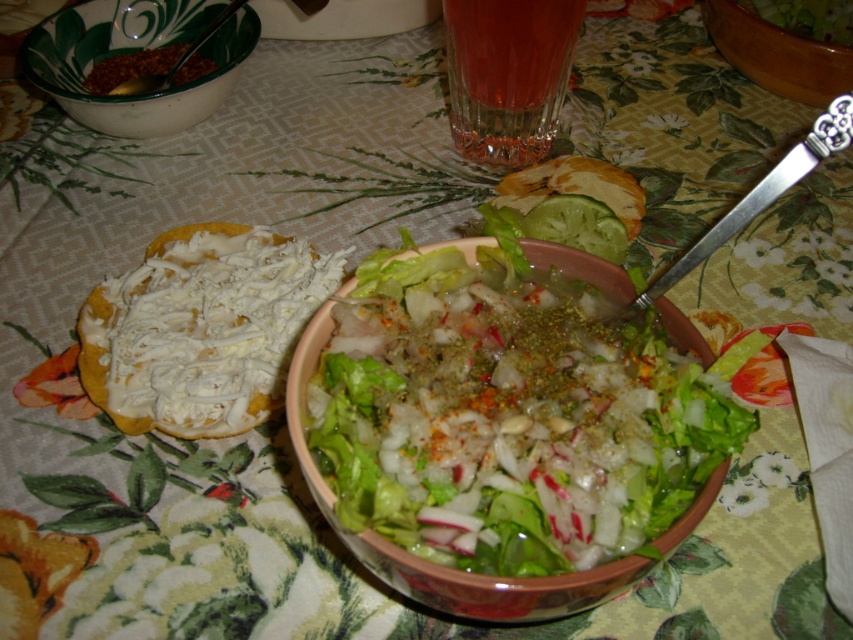
Question: Is fresh green salad at center below green ceramic bowl at upper left?

Choices:
 (A) yes
 (B) no

Answer: (A)

Question: Among these objects, which one is nearest to the camera?

Choices:
 (A) translucent glass at upper center
 (B) fresh green salad at center
 (C) green ceramic bowl at upper left
 (D) silver metallic knife at upper right

Answer: (B)

Question: Can you confirm if green ceramic bowl at upper left is positioned below wooden bowl at upper right?

Choices:
 (A) yes
 (B) no

Answer: (A)

Question: Which point is closer to the camera taking this photo?

Choices:
 (A) (483, 58)
 (B) (749, 77)

Answer: (A)

Question: Which of the following is the closest to the observer?

Choices:
 (A) (486, 97)
 (B) (688, 259)

Answer: (B)

Question: Is green ceramic bowl at upper left thinner than silver metallic knife at upper right?

Choices:
 (A) yes
 (B) no

Answer: (B)